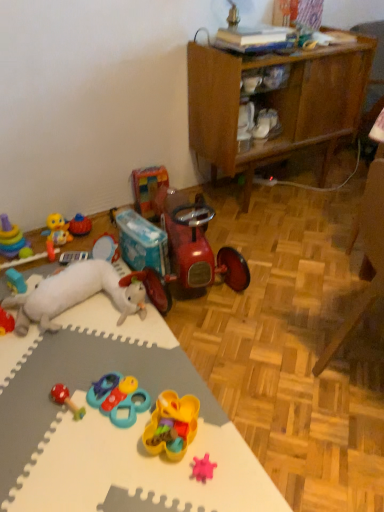
This screenshot has width=384, height=512. What are the coordinates of `vacant space in front of pink rubber star at lower center, placed as the twelfth toy when sorted from left to right` in the screenshot? It's located at (209, 499).